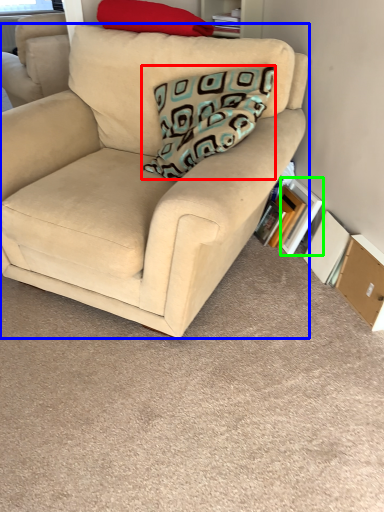
Question: Which object is positioned farthest from pillow (highlighted by a red box)? Select from studio couch (highlighted by a blue box) and paperback book (highlighted by a green box).

Choices:
 (A) studio couch
 (B) paperback book

Answer: (B)